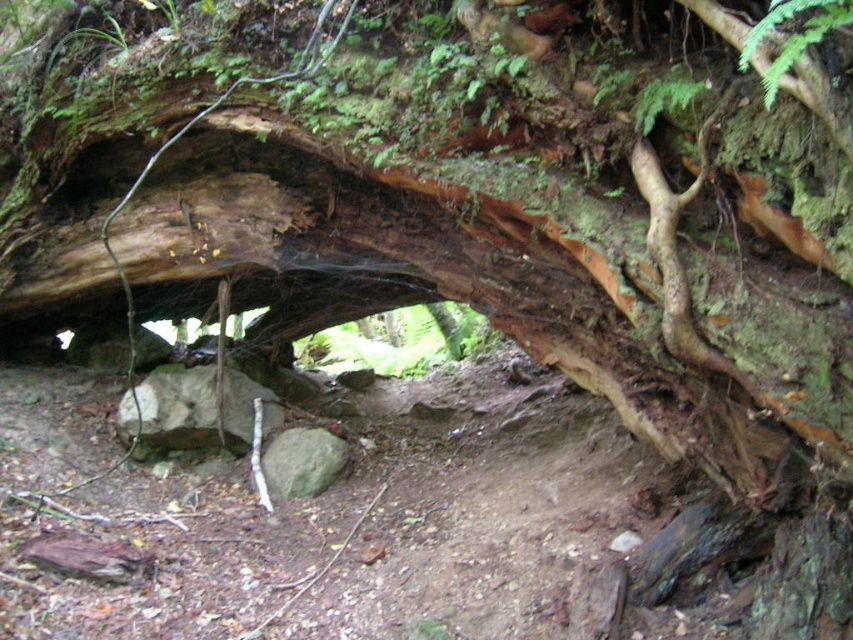
Which is more to the left, gray rock at center or green rough rock at center?

From the viewer's perspective, gray rock at center appears more on the left side.

Is gray rock at center to the right of green rough rock at center from the viewer's perspective?

No, gray rock at center is not to the right of green rough rock at center.

What are the coordinates of `gray rock at center` in the screenshot? It's located at (170, 410).

I want to click on gray rock at center, so click(x=170, y=410).